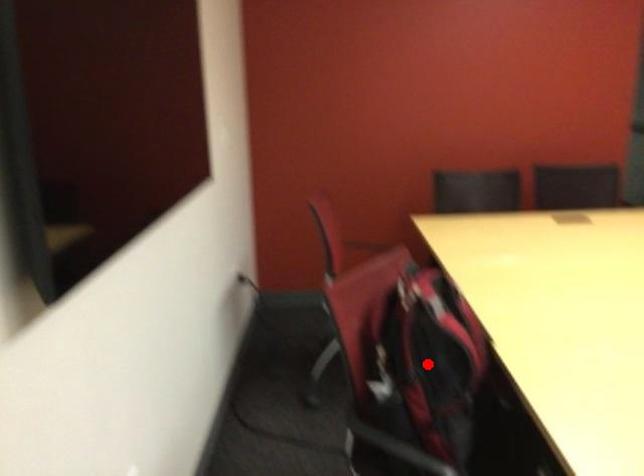
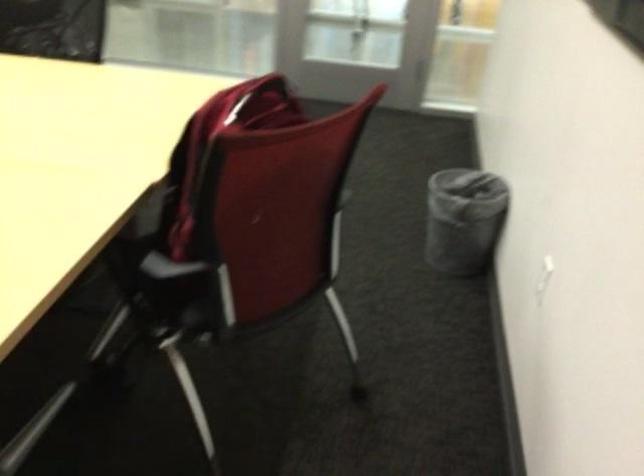
Question: I am providing you with two images of the same scene from different viewpoints. A red point is marked on the first image. Is the red point's position out of view in image 2?

Choices:
 (A) Yes
 (B) No

Answer: (A)